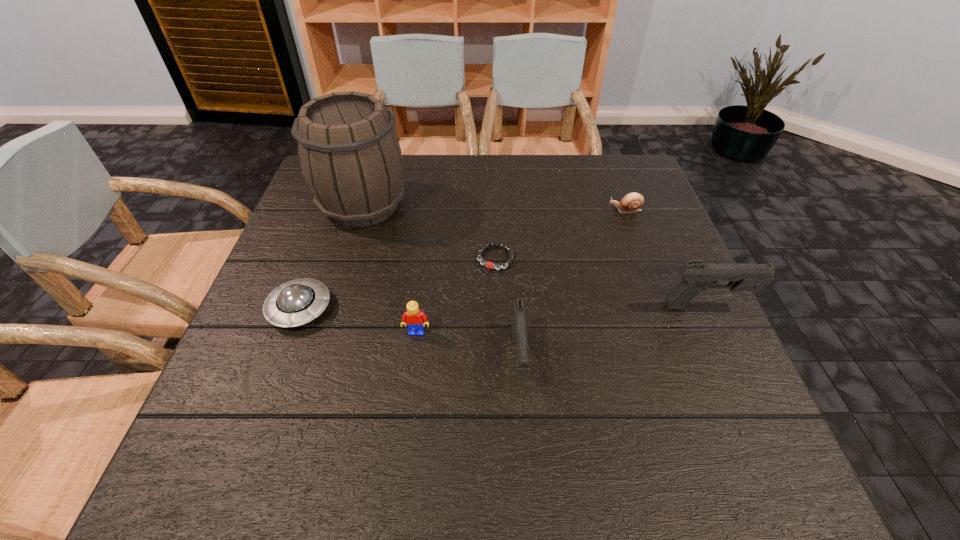
Image resolution: width=960 pixels, height=540 pixels. In order to click on object that is the closest to the third farthest object in this screenshot , I will do `click(519, 330)`.

I want to click on vacant position in the image that satisfies the following two spatial constraints: 1. on the back side of the tallest object; 2. on the right side of the saucer, so click(x=338, y=205).

This screenshot has width=960, height=540. I want to click on vacant region that satisfies the following two spatial constraints: 1. at the barrel of the sixth shortest object; 2. at the barrel of the left pistol, so click(x=732, y=359).